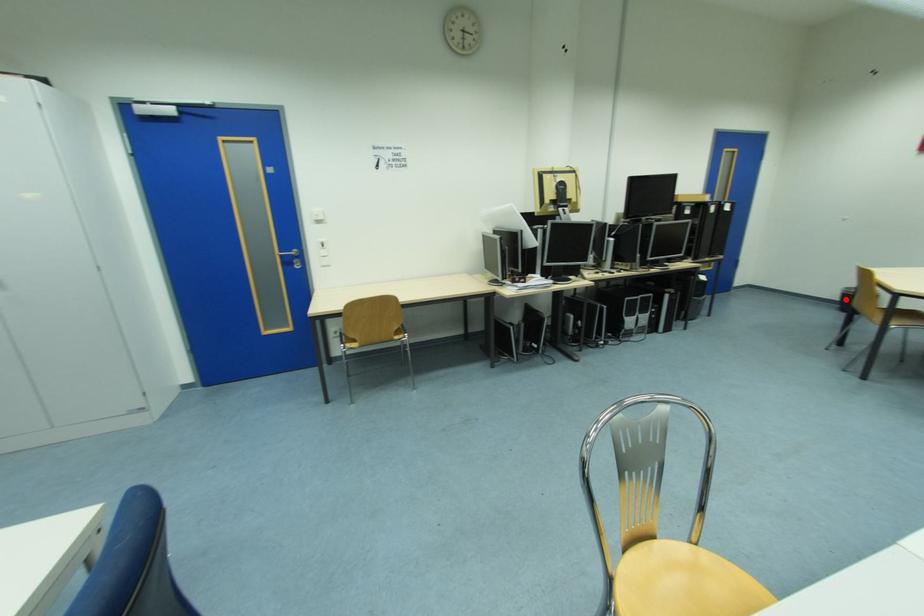
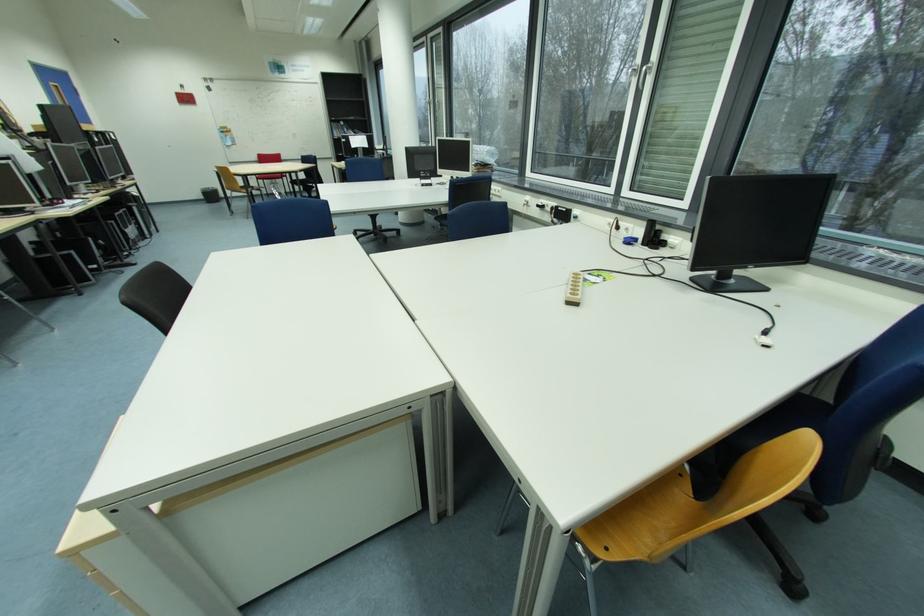
Locate, in the second image, the point that corresponds to the highlighted location in the first image.

(209, 198)